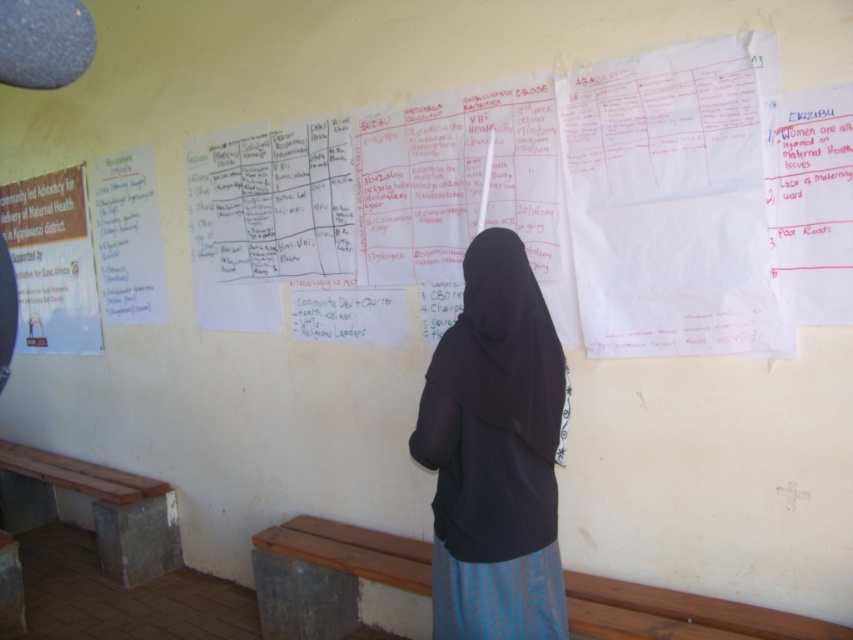
You are an interior designer assessing the wall space. You have a decorative item that is 30 cm wide. You see the black fabric at center and the white paper at left. Which object can the item fit next to without overlapping?

The decorative item that is 30 cm wide can fit next to the white paper at left because the black fabric at center has a smaller width than the white paper at left, so the white paper at left has more space available.

You are a visitor in the room and want to sit on the wooden bench at lower center to read the papers pinned on the wall. Is the black fabric at center blocking your view of the papers?

The black fabric at center is above the wooden bench at lower center, so it might block your view of the papers pinned on the wall.

Consider the image. Based on the scene description, where is the black fabric at center located in terms of its 2D coordinates?

The black fabric at center is located at the 2D coordinates point (495, 452).